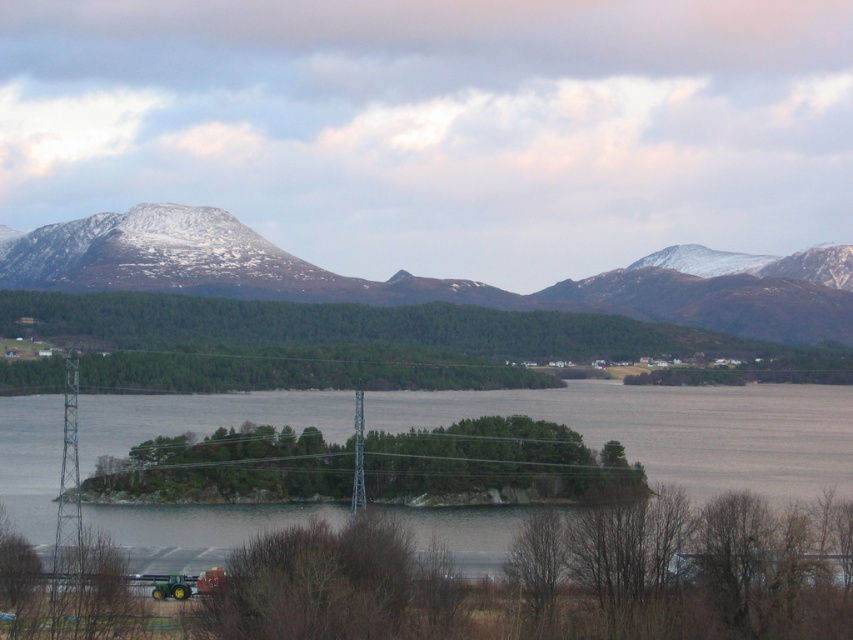
Does clear water at center have a greater width compared to snow-covered mountain at upper center?

No.

Does clear water at center have a larger size compared to snow-covered mountain at upper center?

Yes, clear water at center is bigger than snow-covered mountain at upper center.

The width and height of the screenshot is (853, 640). In order to click on clear water at center in this screenshot , I will do pos(674,429).

At what (x,y) coordinates should I click in order to perform the action: click on clear water at center. Please return your answer as a coordinate pair (x, y). The image size is (853, 640). Looking at the image, I should click on (674, 429).